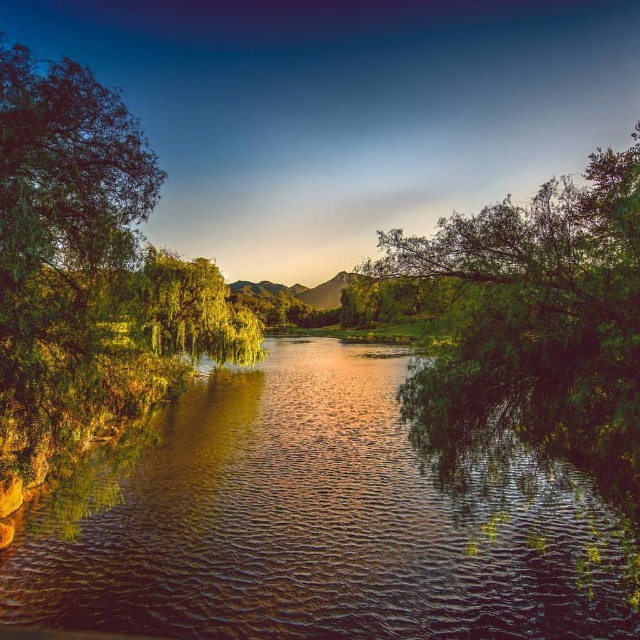
Where is `shiny reflective water at center`? The height and width of the screenshot is (640, 640). shiny reflective water at center is located at coordinates (317, 525).

Does point (1, 577) come in front of point (625, 400)?

No, it is not.

I want to click on shiny reflective water at center, so click(317, 525).

Who is higher up, green leafy tree at left or green leafy tree at right?

green leafy tree at right is above.

Does green leafy tree at left appear on the right side of green leafy tree at right?

Incorrect, green leafy tree at left is not on the right side of green leafy tree at right.

This screenshot has width=640, height=640. I want to click on green leafy tree at left, so click(88, 272).

Identify the location of green leafy tree at left. Image resolution: width=640 pixels, height=640 pixels. (88, 272).

Who is positioned more to the right, shiny reflective water at center or green leafy tree at left?

Positioned to the right is shiny reflective water at center.

Does shiny reflective water at center appear under green leafy tree at left?

Correct, shiny reflective water at center is located below green leafy tree at left.

The width and height of the screenshot is (640, 640). Find the location of `shiny reflective water at center`. shiny reflective water at center is located at coordinates (317, 525).